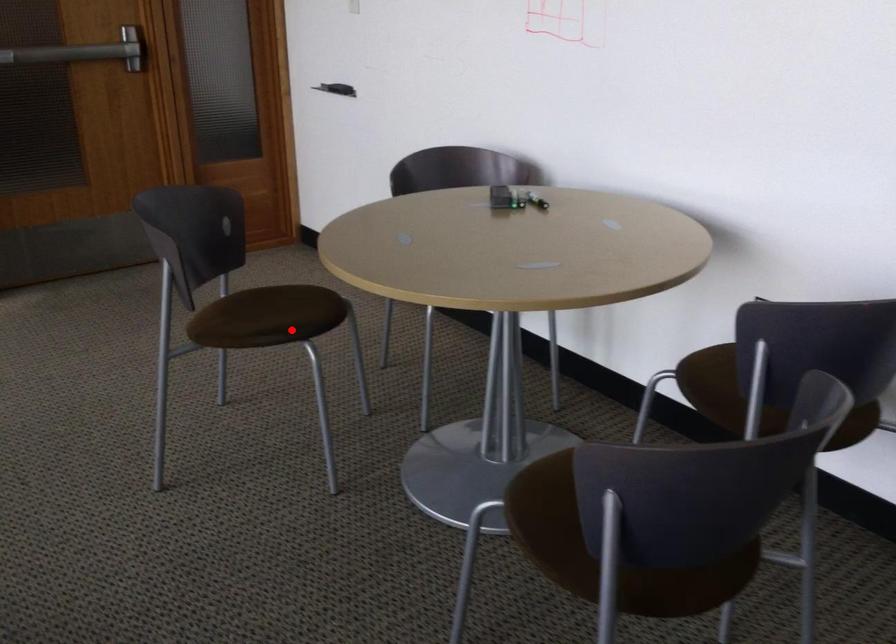
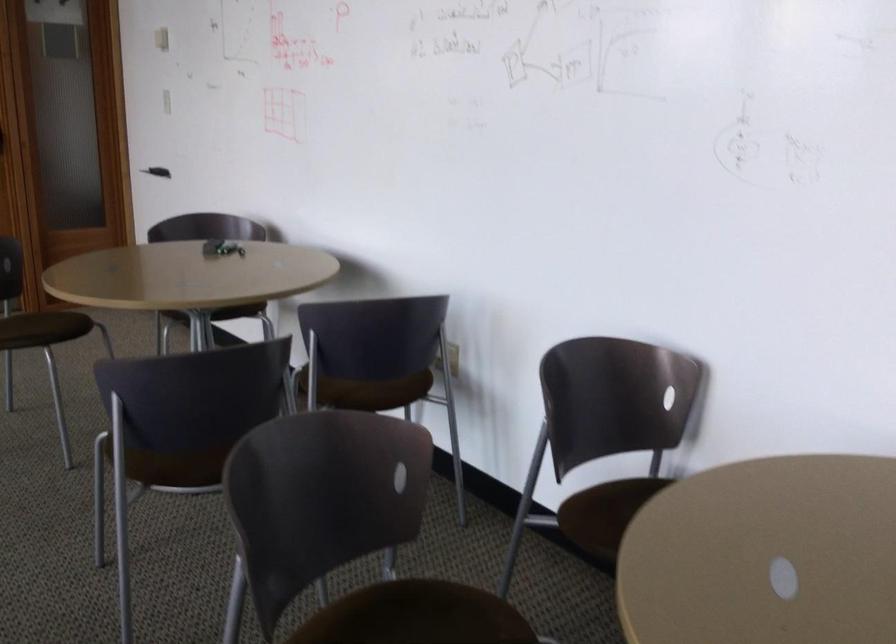
Question: I am providing you with two images of the same scene from different viewpoints. Image1 has a red point marked. In image2, the corresponding 3D location appears at what relative position? Reply with the corresponding letter.

Choices:
 (A) Closer
 (B) Farther

Answer: (B)